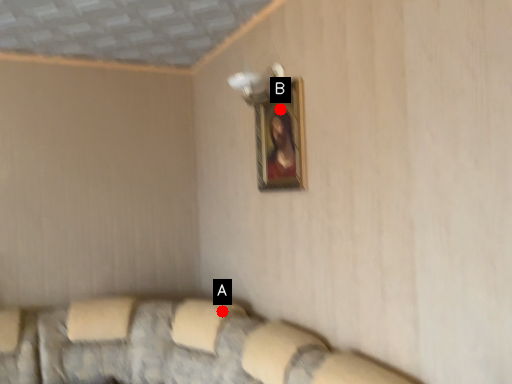
Question: Two points are circled on the image, labeled by A and B beside each circle. Which point is farther from the camera taking this photo?

Choices:
 (A) A is further
 (B) B is further

Answer: (A)